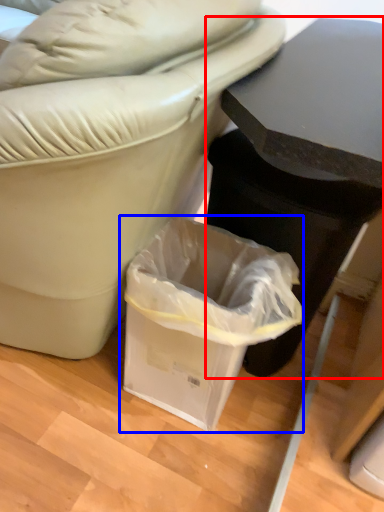
Question: Among these objects, which one is nearest to the camera, table (highlighted by a red box) or waste container (highlighted by a blue box)?

Choices:
 (A) table
 (B) waste container

Answer: (A)